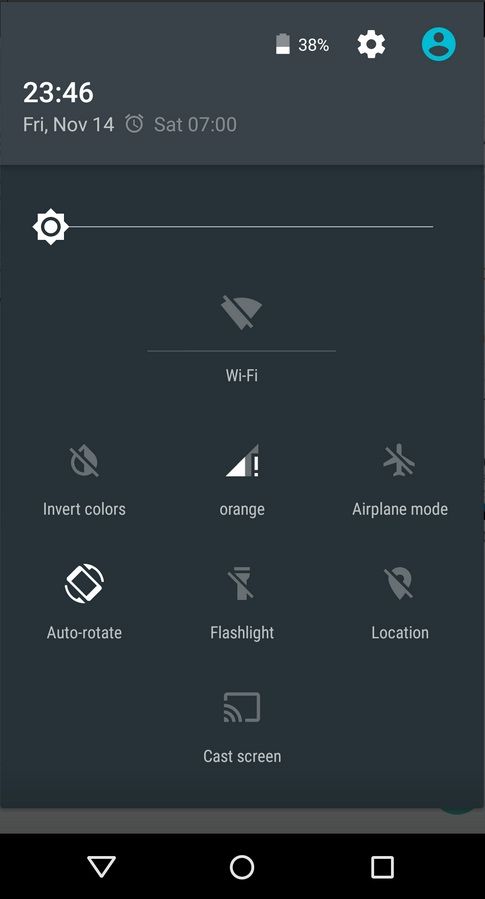
Image resolution: width=485 pixels, height=899 pixels. I want to click on clock, so pyautogui.click(x=78, y=92).